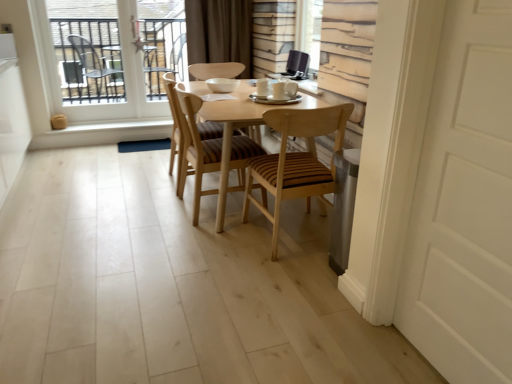
You are a GUI agent. You are given a task and a screenshot of the screen. Output one action in this format:
    pyautogui.click(x=<x>, y=<y>)
    Task: Click on the free point to the left of wooden table at center
    Image resolution: width=512 pixels, height=384 pixels.
    Given the screenshot: What is the action you would take?
    pyautogui.click(x=104, y=198)